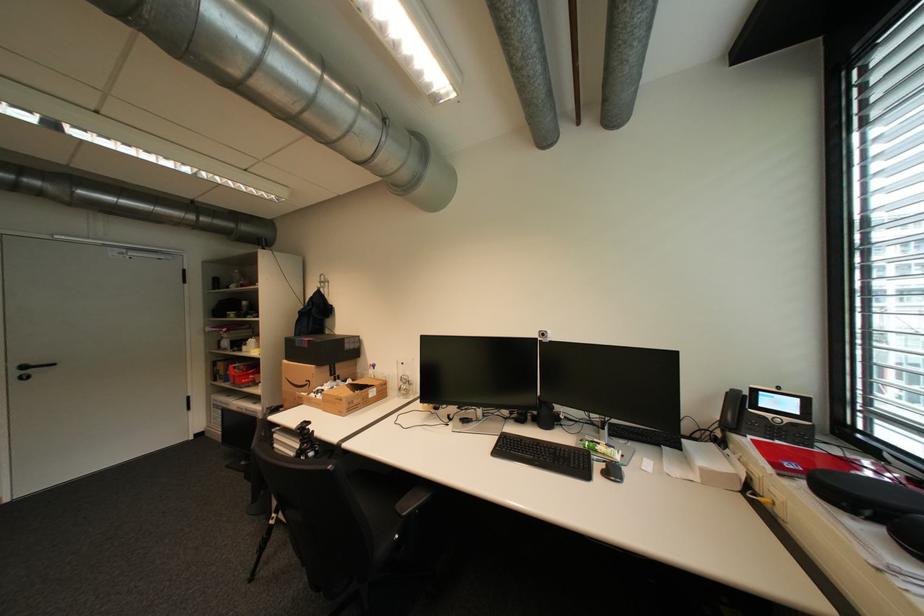
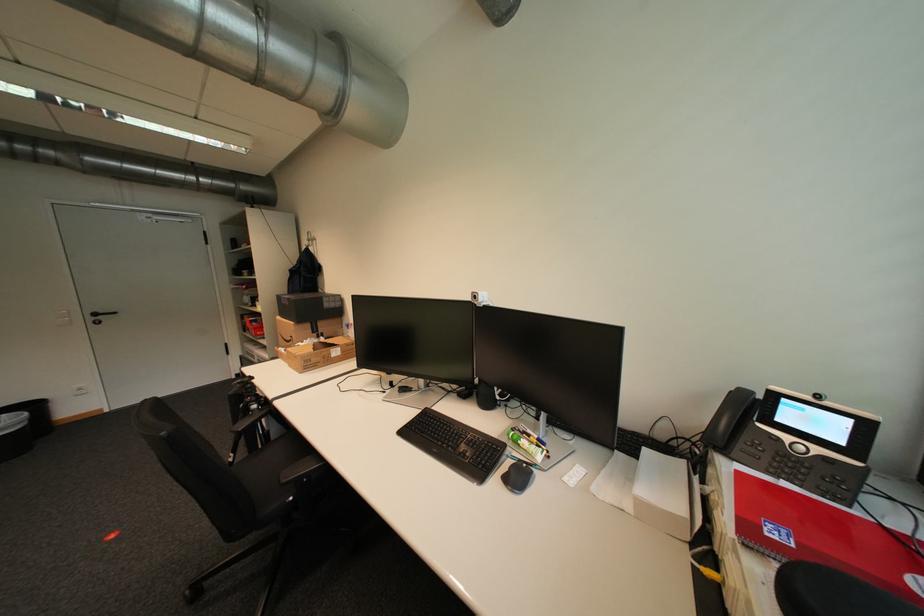
Question: How did the camera likely rotate?

Choices:
 (A) Left
 (B) Right
 (C) Up
 (D) Down

Answer: (A)